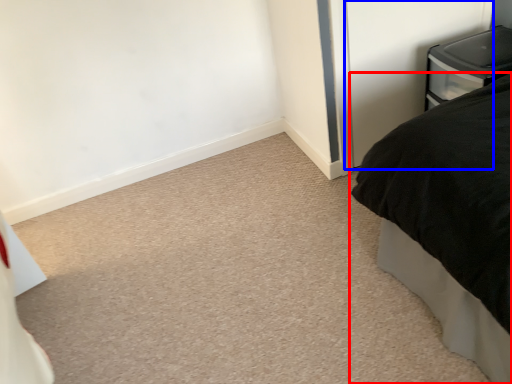
Question: Among these objects, which one is farthest to the camera, bed (highlighted by a red box) or screen door (highlighted by a blue box)?

Choices:
 (A) bed
 (B) screen door

Answer: (B)